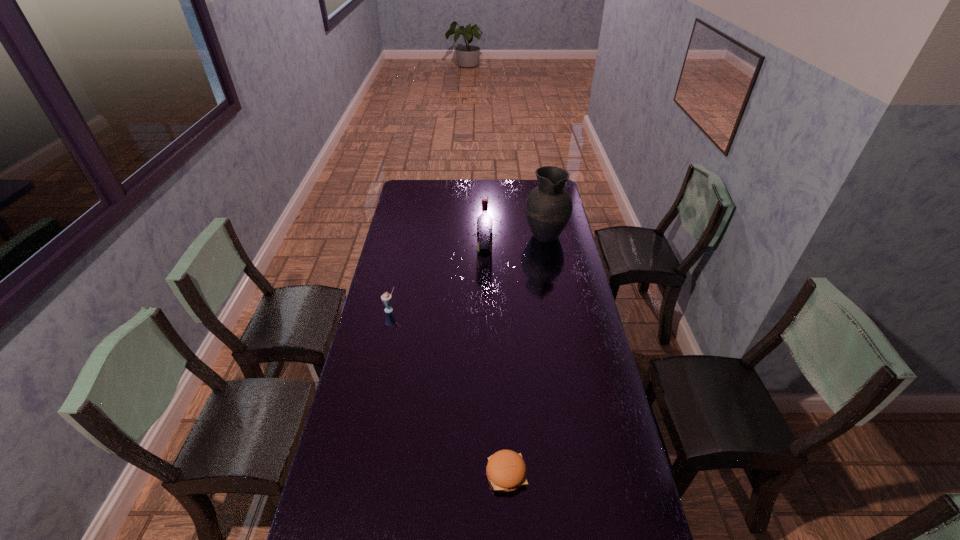
Locate an element on the screen. The width and height of the screenshot is (960, 540). vacant space that satisfies the following two spatial constraints: 1. on the straw side of the nearest object; 2. on the left side of the second shortest object is located at coordinates (355, 474).

Identify the location of free location that satisfies the following two spatial constraints: 1. on the front and back of the alcohol; 2. on the straw side of the leftmost object. (485, 310).

Locate an element on the screen. The width and height of the screenshot is (960, 540). vacant space that satisfies the following two spatial constraints: 1. on the front and back of the alcohol; 2. on the straw side of the milkshake is located at coordinates pos(485,310).

You are a GUI agent. You are given a task and a screenshot of the screen. Output one action in this format:
    pyautogui.click(x=<x>, y=<y>)
    Task: Click on the vacant area in the image that satisfies the following two spatial constraints: 1. on the straw side of the shortest object; 2. on the left side of the second nearest object
    The width and height of the screenshot is (960, 540).
    Given the screenshot: What is the action you would take?
    pyautogui.click(x=355, y=474)

I want to click on vacant space that satisfies the following two spatial constraints: 1. on the front and back of the alcohol; 2. on the straw side of the milkshake, so click(485, 310).

At what (x,y) coordinates should I click in order to perform the action: click on free space that satisfies the following two spatial constraints: 1. on the straw side of the second nearest object; 2. on the right side of the nearest object. Please return your answer as a coordinate pair (x, y). Looking at the image, I should click on [355, 474].

The image size is (960, 540). Identify the location of free space that satisfies the following two spatial constraints: 1. on the straw side of the patty; 2. on the right side of the second nearest object. (355, 474).